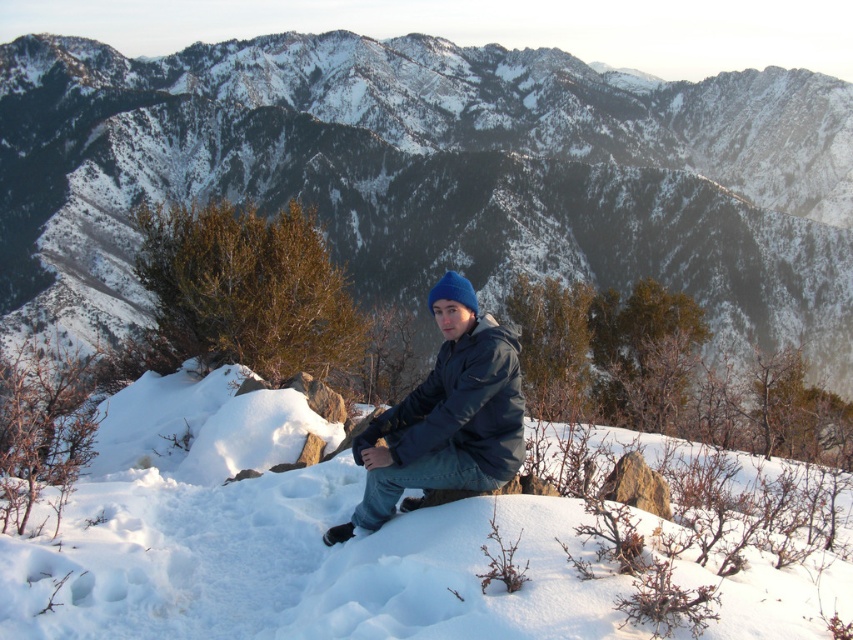
Question: Estimate the real-world distances between objects in this image. Which object is farther from the white fluffy snow at center?

Choices:
 (A) blue matte jacket at center
 (B) snowy mountain at center

Answer: (B)

Question: Can you confirm if white fluffy snow at center is thinner than blue matte jacket at center?

Choices:
 (A) yes
 (B) no

Answer: (B)

Question: Can you confirm if white fluffy snow at center is positioned above blue matte jacket at center?

Choices:
 (A) no
 (B) yes

Answer: (A)

Question: Which object is positioned farthest from the white fluffy snow at center?

Choices:
 (A) snowy mountain at center
 (B) blue matte jacket at center

Answer: (A)

Question: Which of these objects is positioned farthest from the white fluffy snow at center?

Choices:
 (A) snowy mountain at center
 (B) blue matte jacket at center

Answer: (A)

Question: Is white fluffy snow at center below blue matte jacket at center?

Choices:
 (A) yes
 (B) no

Answer: (A)